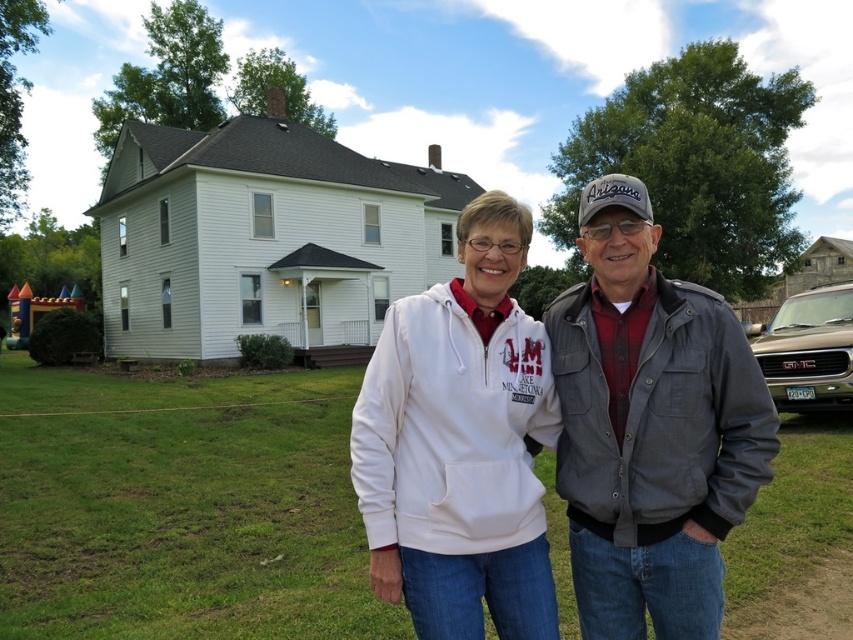
Looking at this image, who is shorter, green grass at lower center or gray cotton jacket at center?

green grass at lower center

Who is higher up, green grass at lower center or gray cotton jacket at center?

gray cotton jacket at center is above.

Is point (190, 493) farther from viewer compared to point (577, 490)?

Yes, it is behind point (577, 490).

At what (x,y) coordinates should I click in order to perform the action: click on green grass at lower center. Please return your answer as a coordinate pair (x, y). Looking at the image, I should click on (181, 508).

Between point (175, 520) and point (445, 541), which one is positioned in front?

Point (445, 541) is more forward.

This screenshot has height=640, width=853. What do you see at coordinates (181, 508) in the screenshot?
I see `green grass at lower center` at bounding box center [181, 508].

Between point (744, 536) and point (527, 326), which one is positioned behind?

Positioned behind is point (744, 536).

Find the location of a particular element. The image size is (853, 640). green grass at lower center is located at coordinates (181, 508).

Does gray cotton jacket at center have a lesser width compared to white fleece hoodie at center?

Indeed, gray cotton jacket at center has a lesser width compared to white fleece hoodie at center.

The image size is (853, 640). Find the location of `gray cotton jacket at center`. gray cotton jacket at center is located at coordinates (650, 428).